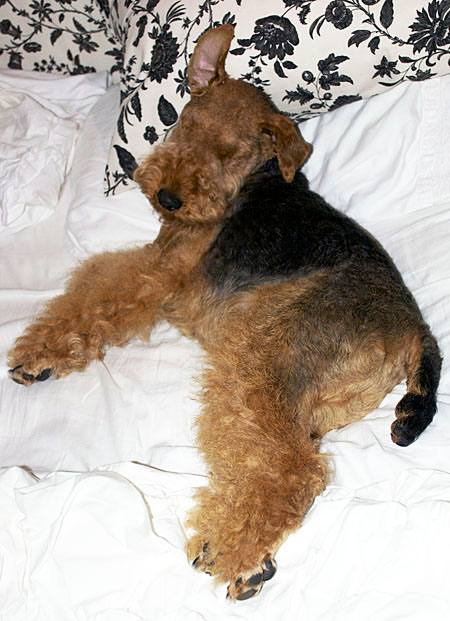
Locate an element on the screen. The width and height of the screenshot is (450, 621). flowers depicted on pillowcase is located at coordinates (273, 15), (425, 30), (29, 15), (163, 58).